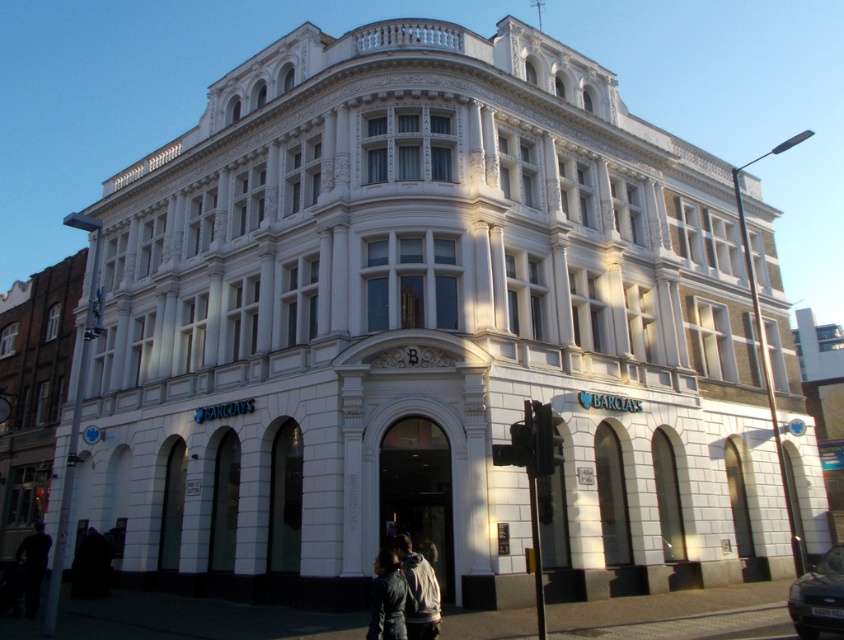
Question: Is white brick building at left bigger than leather jacket at center?

Choices:
 (A) yes
 (B) no

Answer: (A)

Question: Which object appears closest to the camera in this image?

Choices:
 (A) metallic silver car at lower right
 (B) white textured jacket at lower center
 (C) dark fabric jacket at lower left

Answer: (B)

Question: Observing the image, what is the correct spatial positioning of white brick building at left in reference to white textured jacket at lower center?

Choices:
 (A) above
 (B) below

Answer: (A)

Question: Which object is closer to the camera taking this photo?

Choices:
 (A) metallic silver car at lower right
 (B) white textured jacket at lower center
 (C) leather jacket at center

Answer: (C)

Question: Which object is farther from the camera taking this photo?

Choices:
 (A) metallic silver car at lower right
 (B) white textured jacket at lower center
 (C) leather jacket at center
 (D) white brick building at left

Answer: (D)

Question: Is white brick building at left smaller than white textured jacket at lower center?

Choices:
 (A) yes
 (B) no

Answer: (B)